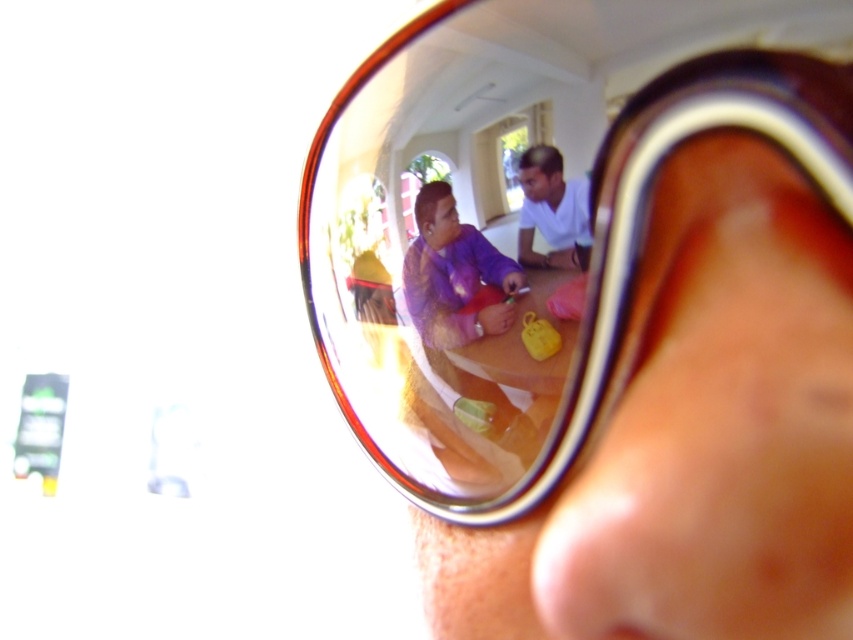
Who is lower down, purple fabric shirt at center or white matte shirt at center?

Positioned lower is purple fabric shirt at center.

Between point (465, 324) and point (531, 160), which one is positioned in front?

Positioned in front is point (531, 160).

You are a GUI agent. You are given a task and a screenshot of the screen. Output one action in this format:
    pyautogui.click(x=<x>, y=<y>)
    Task: Click on the purple fabric shirt at center
    Image resolution: width=853 pixels, height=640 pixels.
    Given the screenshot: What is the action you would take?
    pyautogui.click(x=453, y=275)

Is shiny brown goggles at center positioned behind white matte shirt at center?

No, it is not.

Is shiny brown goggles at center shorter than white matte shirt at center?

Incorrect, shiny brown goggles at center's height does not fall short of white matte shirt at center's.

Is point (593, 312) positioned after point (544, 150)?

No, it is not.

The height and width of the screenshot is (640, 853). I want to click on shiny brown goggles at center, so click(x=509, y=205).

Can you confirm if shiny brown goggles at center is wider than purple fabric shirt at center?

Indeed, shiny brown goggles at center has a greater width compared to purple fabric shirt at center.

Looking at this image, can you confirm if shiny brown goggles at center is smaller than purple fabric shirt at center?

Actually, shiny brown goggles at center might be larger than purple fabric shirt at center.

This screenshot has width=853, height=640. I want to click on shiny brown goggles at center, so click(509, 205).

At what (x,y) coordinates should I click in order to perform the action: click on shiny brown goggles at center. Please return your answer as a coordinate pair (x, y). Looking at the image, I should click on (509, 205).